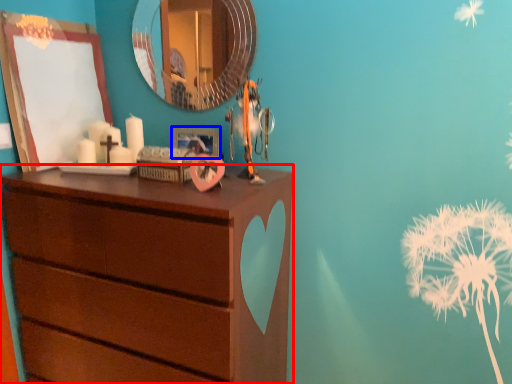
Question: Which object is closer to the camera taking this photo, chest of drawers (highlighted by a red box) or picture frame (highlighted by a blue box)?

Choices:
 (A) chest of drawers
 (B) picture frame

Answer: (A)